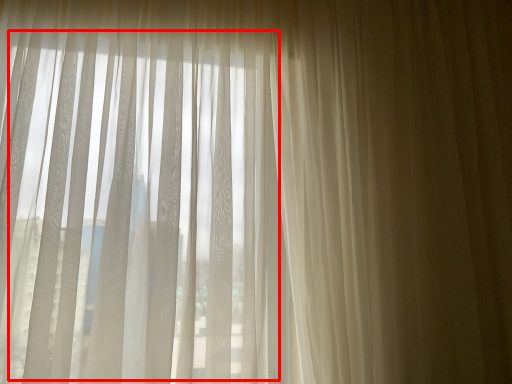
Question: From the image's perspective, what is the correct spatial relationship of bay window (annotated by the red box) in relation to curtain?

Choices:
 (A) above
 (B) below

Answer: (B)